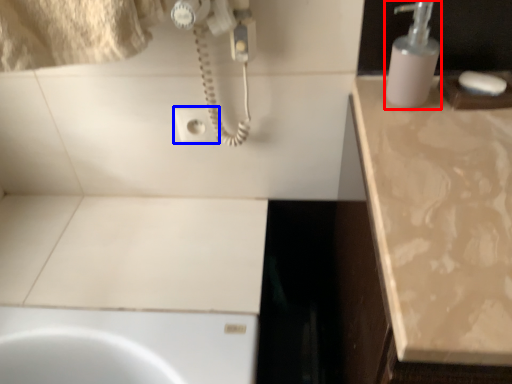
Question: Among these objects, which one is nearest to the camera, soap dispenser (highlighted by a red box) or electric outlet (highlighted by a blue box)?

Choices:
 (A) soap dispenser
 (B) electric outlet

Answer: (A)